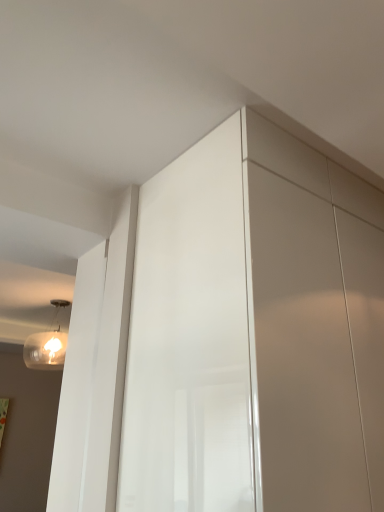
Question: Considering the relative positions of translucent glass light fixture at upper left and glossy white dresser at center in the image provided, is translucent glass light fixture at upper left to the right of glossy white dresser at center from the viewer's perspective?

Choices:
 (A) yes
 (B) no

Answer: (B)

Question: Considering the relative positions of translucent glass light fixture at upper left and glossy white dresser at center in the image provided, is translucent glass light fixture at upper left behind glossy white dresser at center?

Choices:
 (A) yes
 (B) no

Answer: (A)

Question: Is glossy white dresser at center inside translucent glass light fixture at upper left?

Choices:
 (A) no
 (B) yes

Answer: (A)

Question: Could you tell me if translucent glass light fixture at upper left is turned towards glossy white dresser at center?

Choices:
 (A) yes
 (B) no

Answer: (B)

Question: From the image's perspective, is translucent glass light fixture at upper left under glossy white dresser at center?

Choices:
 (A) yes
 (B) no

Answer: (A)

Question: Considering the relative sizes of translucent glass light fixture at upper left and glossy white dresser at center in the image provided, is translucent glass light fixture at upper left thinner than glossy white dresser at center?

Choices:
 (A) yes
 (B) no

Answer: (A)

Question: Is glossy white dresser at center aimed at translucent glass light fixture at upper left?

Choices:
 (A) no
 (B) yes

Answer: (A)

Question: Is glossy white dresser at center at the right side of translucent glass light fixture at upper left?

Choices:
 (A) no
 (B) yes

Answer: (B)

Question: From the image's perspective, is glossy white dresser at center on translucent glass light fixture at upper left?

Choices:
 (A) no
 (B) yes

Answer: (B)

Question: Is glossy white dresser at center positioned in front of translucent glass light fixture at upper left?

Choices:
 (A) yes
 (B) no

Answer: (A)

Question: Can translucent glass light fixture at upper left be found inside glossy white dresser at center?

Choices:
 (A) no
 (B) yes

Answer: (A)

Question: Considering the relative sizes of glossy white dresser at center and translucent glass light fixture at upper left in the image provided, is glossy white dresser at center bigger than translucent glass light fixture at upper left?

Choices:
 (A) yes
 (B) no

Answer: (A)

Question: Considering the positions of point (66, 302) and point (147, 267), is point (66, 302) closer or farther from the camera than point (147, 267)?

Choices:
 (A) closer
 (B) farther

Answer: (B)